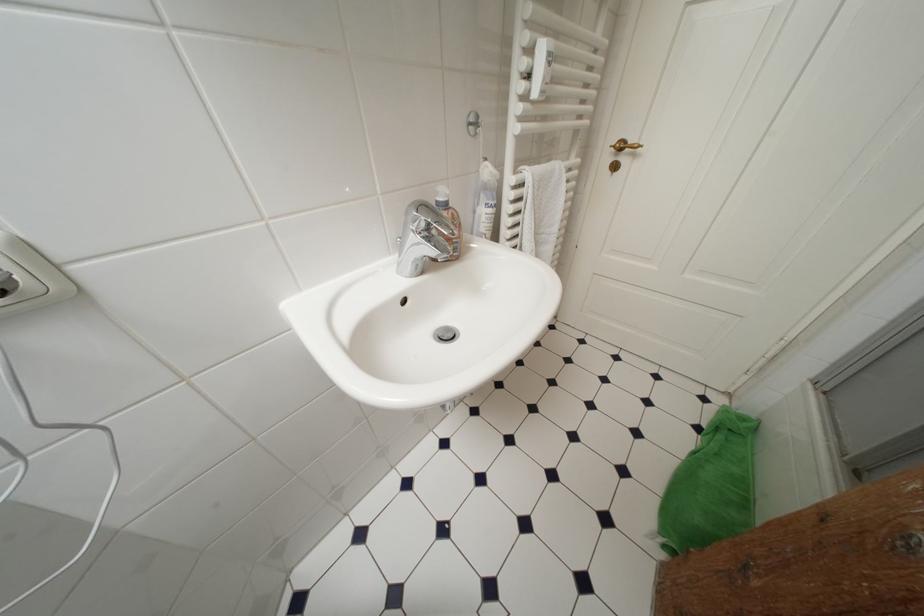
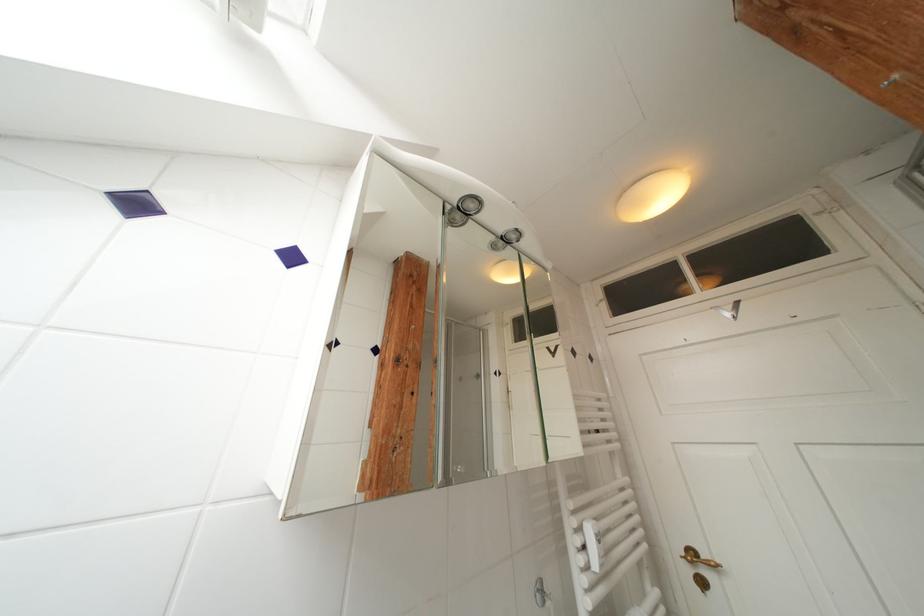
Find the pixel in the second image that matches pixel 537 53 in the first image.

(586, 533)